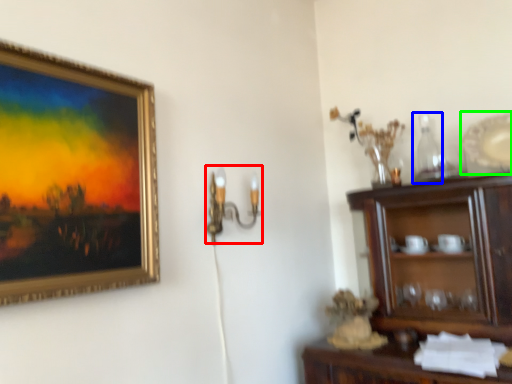
Question: Based on their relative distances, which object is nearer to candle holder (highlighted by a red box)? Choose from bottle (highlighted by a blue box) and platter (highlighted by a green box).

Choices:
 (A) bottle
 (B) platter

Answer: (A)